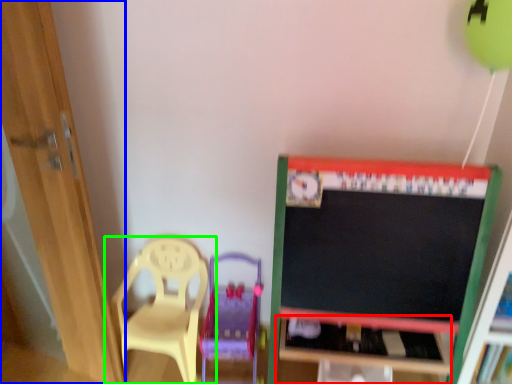
Question: Estimate the real-world distances between objects in this image. Which object is farther from table (highlighted by a red box), door (highlighted by a blue box) or chair (highlighted by a green box)?

Choices:
 (A) door
 (B) chair

Answer: (A)